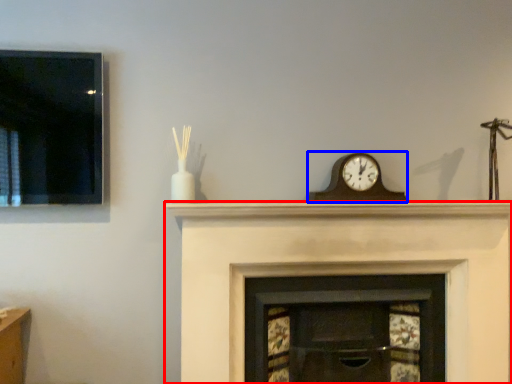
Question: Which object is closer to the camera taking this photo, fireplace (highlighted by a red box) or wall clock (highlighted by a blue box)?

Choices:
 (A) fireplace
 (B) wall clock

Answer: (A)